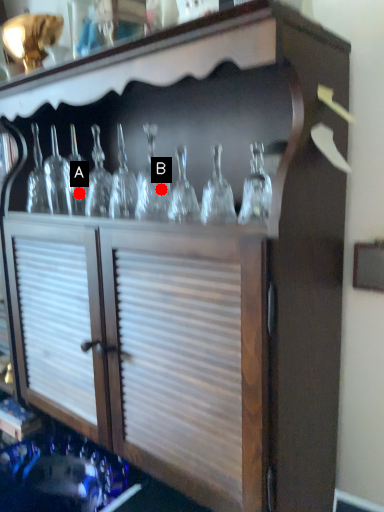
Question: Two points are circled on the image, labeled by A and B beside each circle. Which of the following is the farthest from the observer?

Choices:
 (A) A is further
 (B) B is further

Answer: (A)